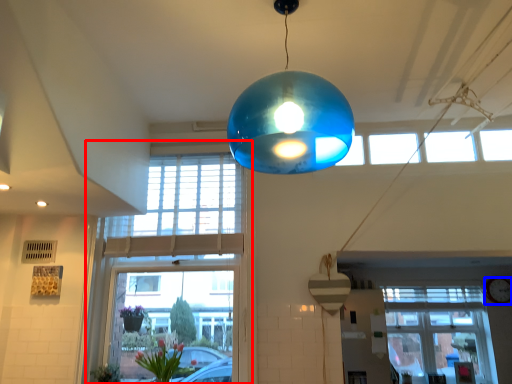
Question: Which object is further to the camera taking this photo, window (highlighted by a red box) or clock (highlighted by a blue box)?

Choices:
 (A) window
 (B) clock

Answer: (B)